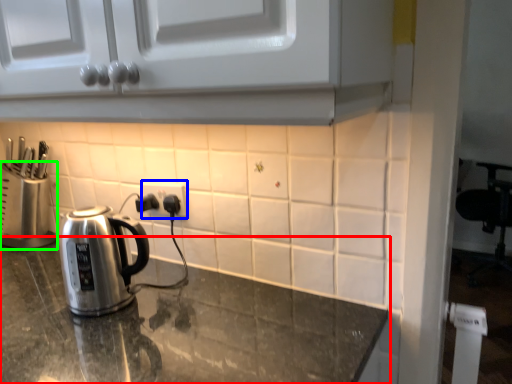
Question: Considering the real-world distances, which object is closest to countertop (highlighted by a red box)? electric outlet (highlighted by a blue box) or appliance (highlighted by a green box).

Choices:
 (A) electric outlet
 (B) appliance

Answer: (A)